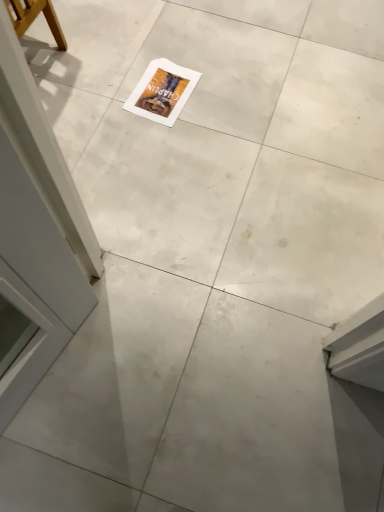
Find the location of a particular element. free region under white paper postcard at center (from a real-world perspective) is located at coordinates (160, 86).